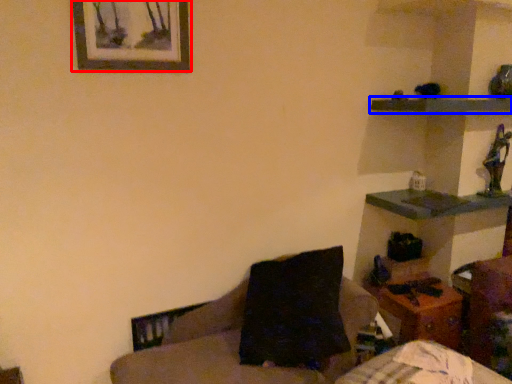
Question: Which object appears closest to the camera in this image, picture frame (highlighted by a red box) or shelf (highlighted by a blue box)?

Choices:
 (A) picture frame
 (B) shelf

Answer: (A)